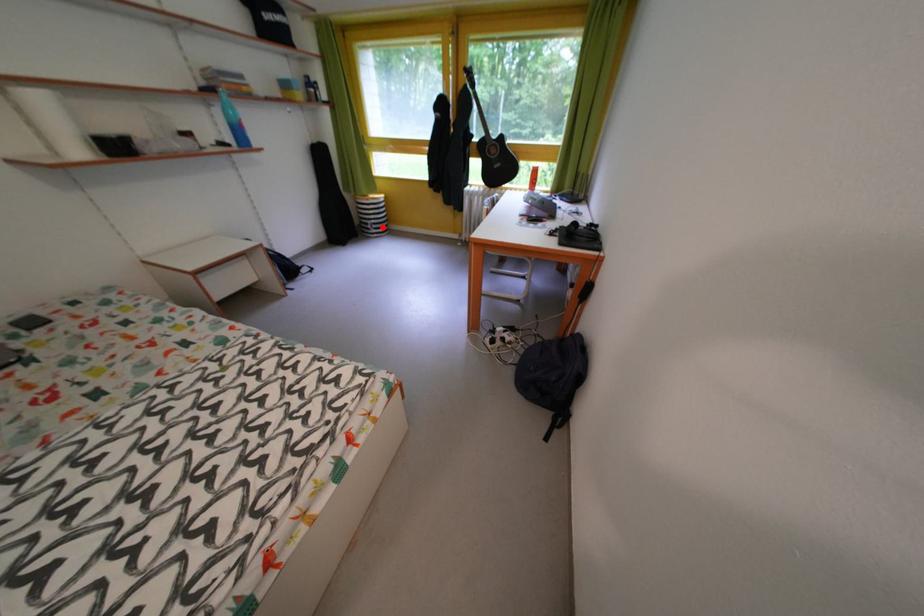
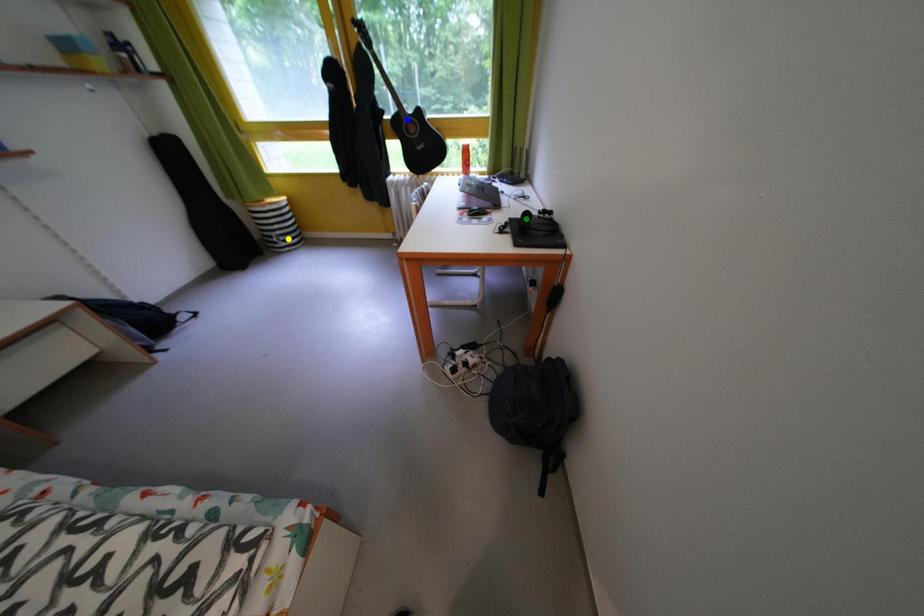
Question: I am providing you with two images of the same scene from different viewpoints. A red point is marked on the first image. You are given multiple points on the second image. In image 2, which mark is for the same physical point as the one in image 1?

Choices:
 (A) yellow point
 (B) blue point
 (C) green point

Answer: (A)